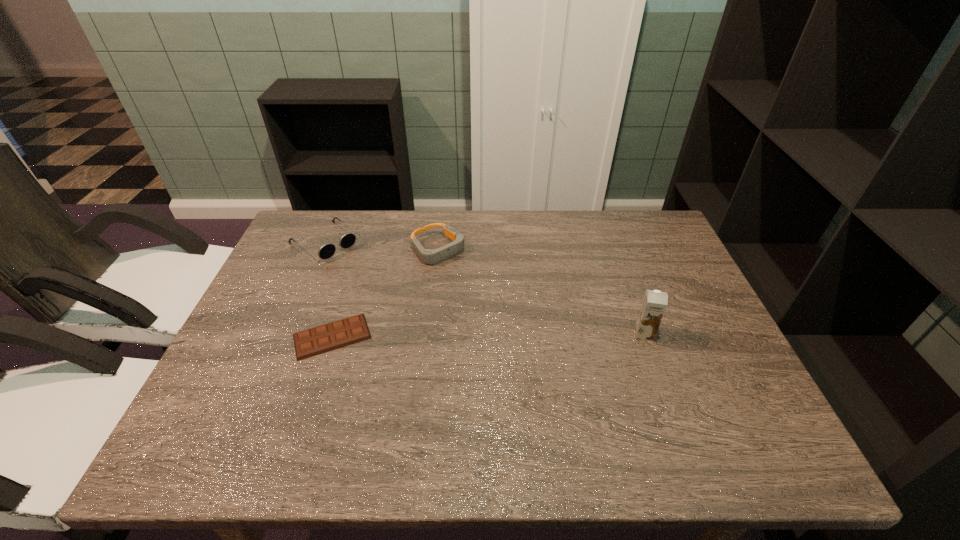
This screenshot has width=960, height=540. Find the location of `vacant area situated on the front-facing side of the sunglasses`. vacant area situated on the front-facing side of the sunglasses is located at coordinates (401, 302).

Image resolution: width=960 pixels, height=540 pixels. What are the coordinates of `vacant space located on the front-facing side of the sunglasses` in the screenshot? It's located at (372, 279).

In order to click on vacant space located 0.350m on the front-facing side of the sunglasses in this screenshot , I will do `click(423, 319)`.

Identify the location of goggles that is positioned at the far edge. (430, 256).

Where is `sunglasses present at the far edge`? This screenshot has height=540, width=960. sunglasses present at the far edge is located at coordinates (327, 250).

This screenshot has width=960, height=540. I want to click on chocolate bar that is at the left edge, so click(x=311, y=342).

Find the location of a particular element. sunglasses located at the left edge is located at coordinates (327, 250).

Identify the location of object that is at the far left corner. (327, 250).

The height and width of the screenshot is (540, 960). In order to click on vacant space at the far edge of the desktop in this screenshot , I will do `click(565, 232)`.

Where is `blank area at the near edge`? The image size is (960, 540). blank area at the near edge is located at coordinates (481, 387).